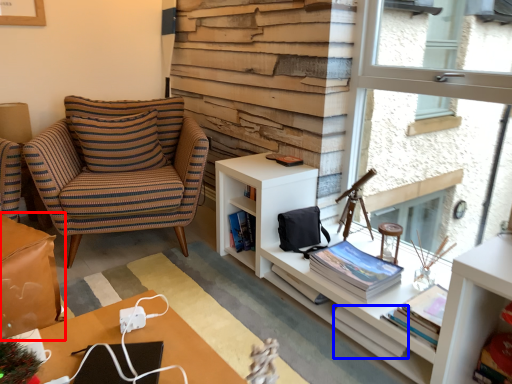
Question: Which point is further to the camera, table (highlighted by a red box) or book (highlighted by a blue box)?

Choices:
 (A) table
 (B) book

Answer: (B)